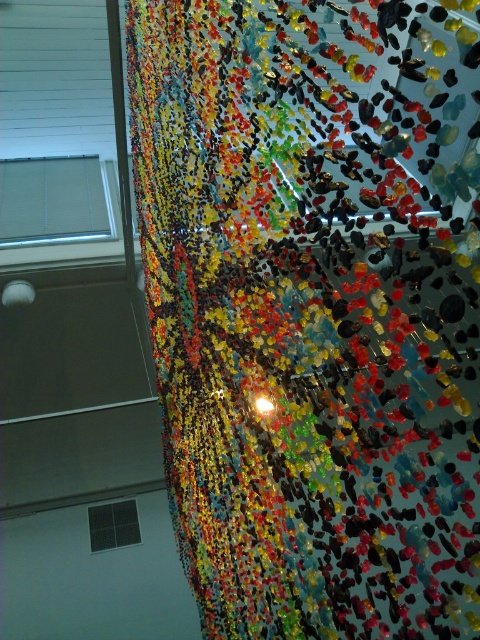
Question: Is white blinds at upper left positioned at the back of black glass window at lower left?

Choices:
 (A) no
 (B) yes

Answer: (A)

Question: Considering the real-world distances, which object is closest to the black glass window at lower left?

Choices:
 (A) translucent glass confetti at upper center
 (B) white blinds at upper left

Answer: (B)

Question: Is translucent glass confetti at upper center closer to the viewer compared to white blinds at upper left?

Choices:
 (A) yes
 (B) no

Answer: (A)

Question: Which point appears farthest from the camera in this image?

Choices:
 (A) (107, 220)
 (B) (130, 499)

Answer: (B)

Question: Which object is closer to the camera taking this photo?

Choices:
 (A) translucent glass confetti at upper center
 (B) white blinds at upper left

Answer: (A)

Question: From the image, what is the correct spatial relationship of translucent glass confetti at upper center in relation to white blinds at upper left?

Choices:
 (A) above
 (B) below

Answer: (B)